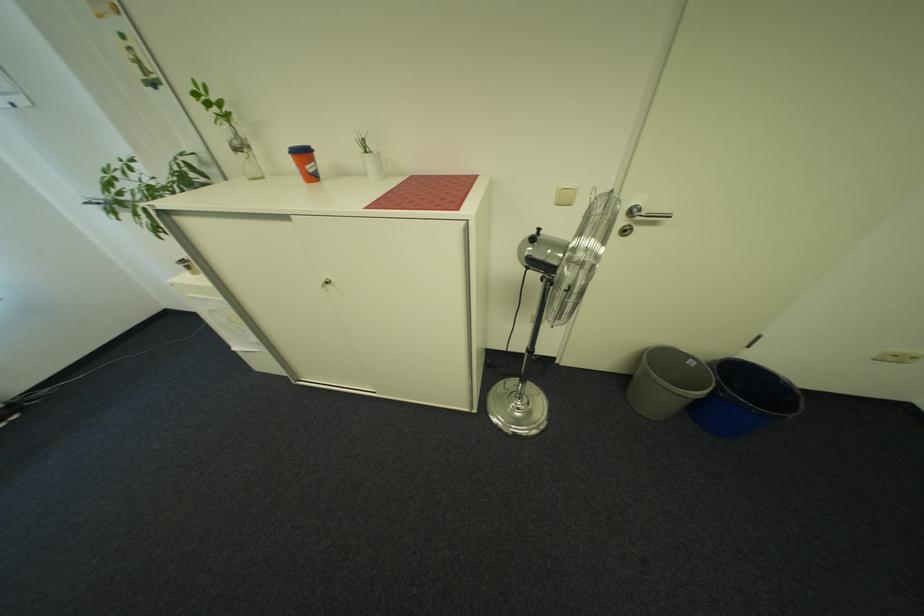
Find where to turn the cabinet lock. Please return your answer as a coordinate pair (x, y).

(188, 265)